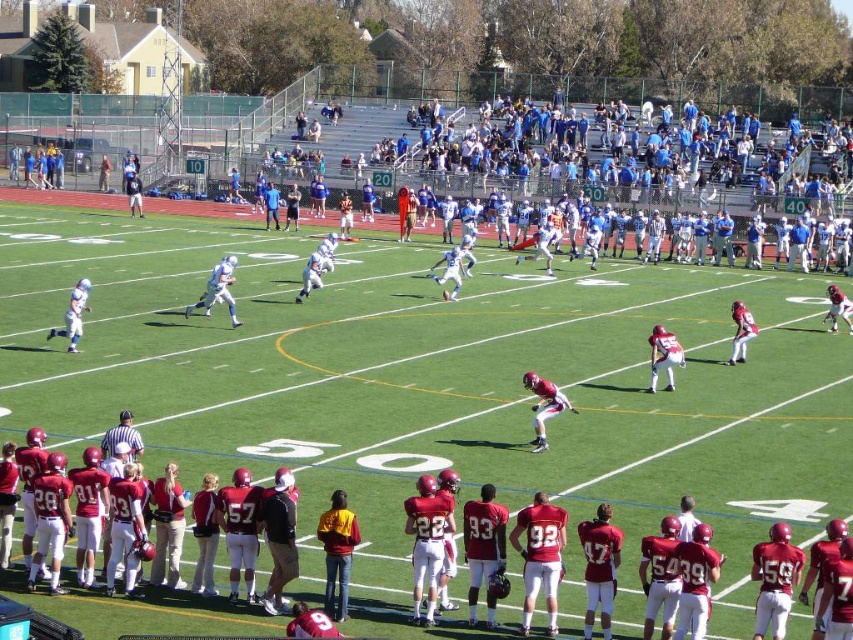
You are standing at the point with coordinates point (x=228, y=269) and want to throw a ball to a friend who is standing at the viewer position. If the maximum distance you can throw is 30 meters, will you be able to reach them?

The distance between point (x=228, y=269) and the viewer is 28.82 meters, which is within your throwing range of 30 meters. Yes, you can reach them.